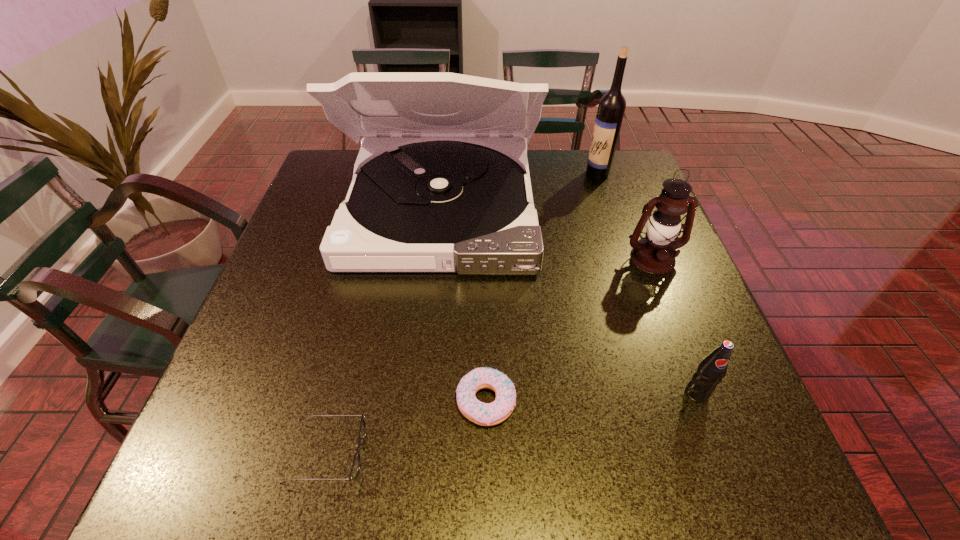
This screenshot has width=960, height=540. I want to click on CD player, so [435, 189].

You are a GUI agent. You are given a task and a screenshot of the screen. Output one action in this format:
    pyautogui.click(x=<x>, y=<y>)
    Task: Click on the wine bottle
    This screenshot has height=540, width=960.
    Given the screenshot: What is the action you would take?
    pyautogui.click(x=611, y=108)

The width and height of the screenshot is (960, 540). Find the location of `lantern`. lantern is located at coordinates click(x=655, y=253).

Image resolution: width=960 pixels, height=540 pixels. I want to click on the third shortest object, so click(710, 371).

At what (x,y) coordinates should I click in order to perform the action: click on the second shortest object. Please return your answer as a coordinate pair (x, y). This screenshot has width=960, height=540. Looking at the image, I should click on (485, 414).

In order to click on spectacles in this screenshot , I will do `click(354, 472)`.

Find the location of a particular element. free space located on the control panel of the CD player is located at coordinates point(419,414).

Image resolution: width=960 pixels, height=540 pixels. I want to click on free location located on the label of the wine bottle, so click(x=539, y=174).

This screenshot has height=540, width=960. What are the coordinates of `vacant space located on the label of the wine bottle` in the screenshot? It's located at (489, 174).

Where is `vacant space located on the label of the wine bottle`? vacant space located on the label of the wine bottle is located at coordinates (529, 174).